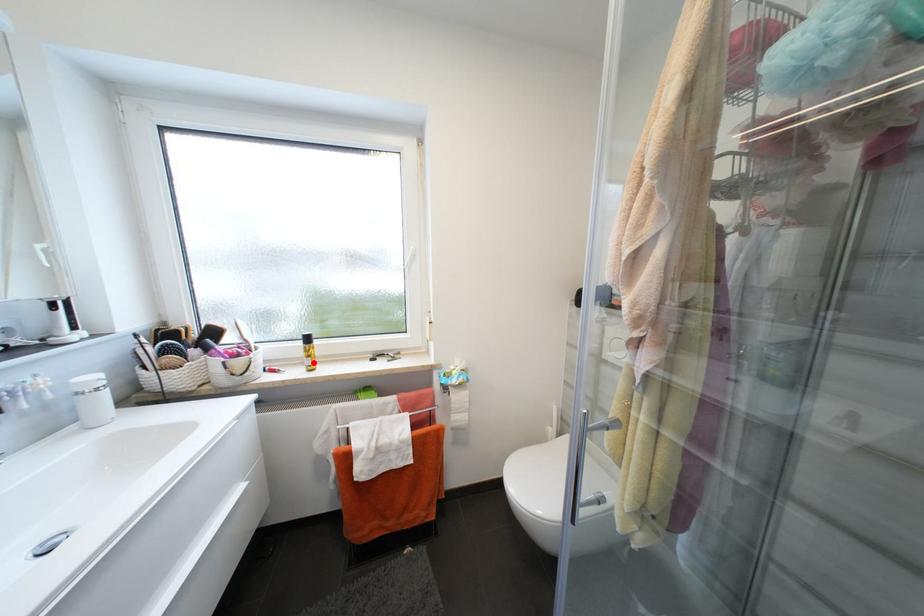
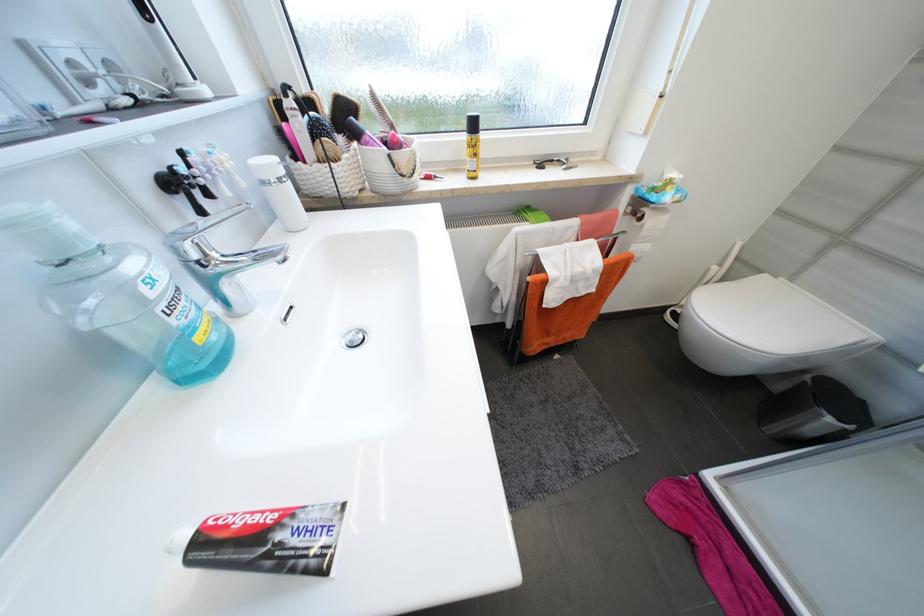
Locate, in the second image, the point that corresponds to the highlighted location in the first image.

(477, 166)